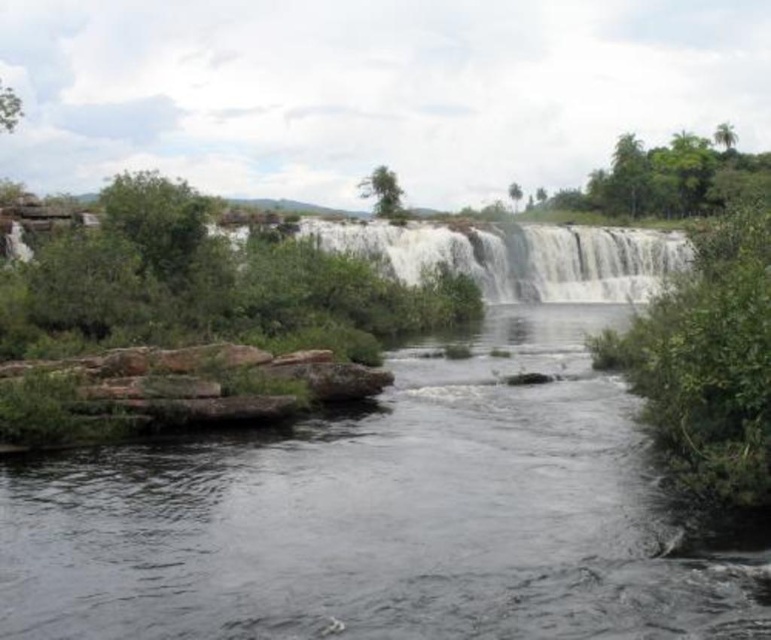
Is point (332, 417) farther from viewer compared to point (500, 264)?

No, (332, 417) is in front of (500, 264).

Where is `clear water at center`? clear water at center is located at coordinates (381, 516).